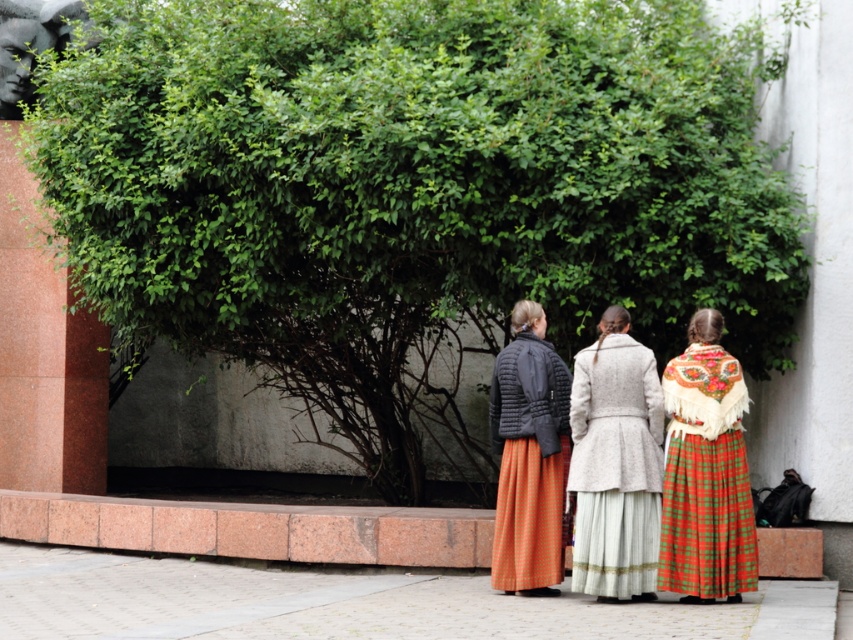
You are a photographer trying to capture a photo of the matte black jacket at center and the brushed metal sculpture at upper left. Since the bush is in the way, you need to move closer to the bush. Which object will require you to move closer to the bush to fully capture it in the photo?

The matte black jacket at center has a smaller size compared to the brushed metal sculpture at upper left, so you will need to move closer to the bush to fully capture the smaller matte black jacket at center in the photo.

You are a photographer trying to capture a group photo of the matte black jacket at center and the brushed metal sculpture at upper left. The camera you are using has a maximum width capacity of 2 meters. Based on their sizes, can both subjects fit within the camera frame without cropping?

The matte black jacket at center is narrower than the brushed metal sculpture at upper left. Since the camera can capture up to 2 meters, and the sculpture is wider, but the total width of both together may still fit within the 2 meters if their combined width is under that limit. However, the exact combined width isn

You are a photographer trying to capture a group photo of the light gray wool coat at center and the plaid wool skirt at center. Since you want to ensure both subjects are fully visible, which one should you position closer to the camera to avoid being blocked by the large bush behind them?

The light gray wool coat at center should be positioned closer to the camera because it is above the plaid wool skirt at center, so moving it forward will prevent it from blocking the view of the skirt behind it.